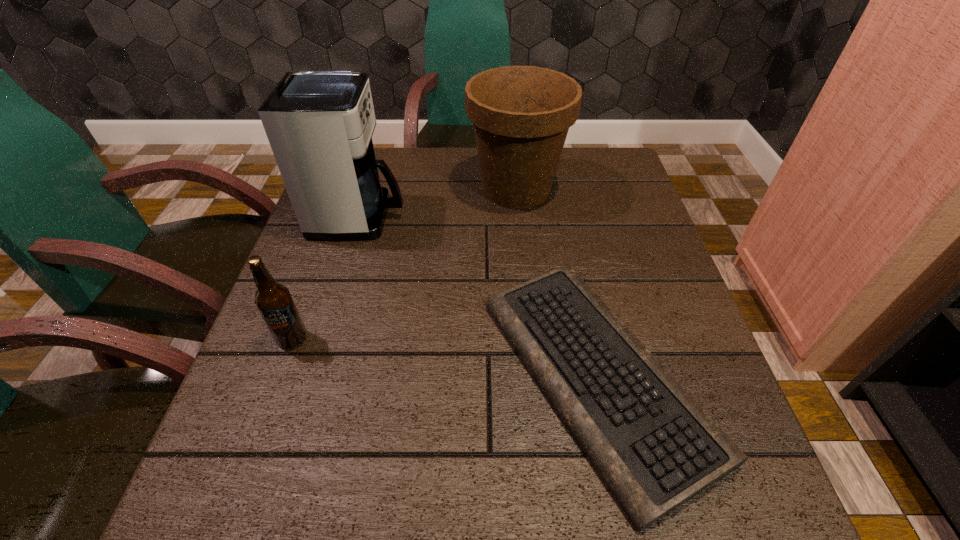
This screenshot has height=540, width=960. Find the location of `free point between the computer keyboard and the beer bottle`. free point between the computer keyboard and the beer bottle is located at coordinates (444, 357).

The height and width of the screenshot is (540, 960). In order to click on vacant region between the second shortest object and the flowerpot in this screenshot , I will do `click(404, 264)`.

Where is `vacant space that is in between the tallest object and the flowerpot`? The width and height of the screenshot is (960, 540). vacant space that is in between the tallest object and the flowerpot is located at coordinates (438, 203).

Where is `the second closest object relative to the coffee maker`? The image size is (960, 540). the second closest object relative to the coffee maker is located at coordinates (655, 448).

Identify which object is the second nearest to the flowerpot. Please provide its 2D coordinates. Your answer should be formatted as a tuple, i.e. [(x, y)], where the tuple contains the x and y coordinates of a point satisfying the conditions above.

[(655, 448)]

Locate an element on the screen. vacant space that satisfies the following two spatial constraints: 1. on the label of the third tallest object; 2. on the left side of the shortest object is located at coordinates (279, 377).

Identify the location of vacant area that satisfies the following two spatial constraints: 1. on the front panel of the shortest object; 2. on the right side of the coffee maker. The image size is (960, 540). (312, 377).

Where is `free space that satisfies the following two spatial constraints: 1. on the front side of the second tallest object; 2. on the front panel of the coffee maker`? The image size is (960, 540). free space that satisfies the following two spatial constraints: 1. on the front side of the second tallest object; 2. on the front panel of the coffee maker is located at coordinates [x=519, y=217].

This screenshot has width=960, height=540. In order to click on free location that satisfies the following two spatial constraints: 1. on the front panel of the coffee maker; 2. on the left side of the shortest object in this screenshot , I will do `click(312, 377)`.

I want to click on free spot that satisfies the following two spatial constraints: 1. on the front side of the second tallest object; 2. on the left side of the computer keyboard, so 535,377.